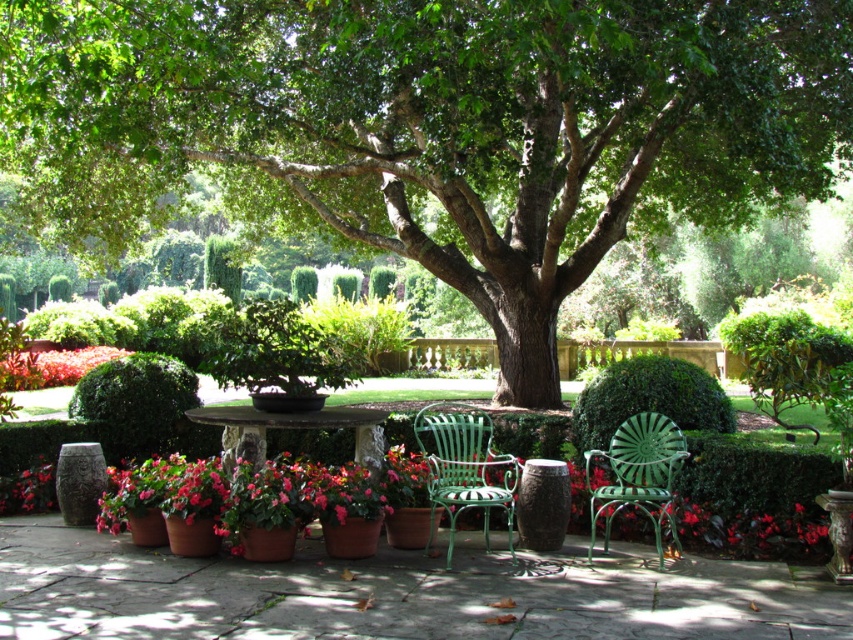
Question: Which of the following is the farthest from the observer?

Choices:
 (A) green textured bush at center
 (B) green textured hedge at center

Answer: (A)

Question: Which object appears farthest from the camera in this image?

Choices:
 (A) vivid red petals at lower left
 (B) green textured hedge at center
 (C) green leafy tree at center

Answer: (A)

Question: Does green wrought iron chair at center appear under vivid red petals at lower left?

Choices:
 (A) no
 (B) yes

Answer: (B)

Question: Which point is farther to the camera?

Choices:
 (A) (91, 392)
 (B) (637, 506)
 (C) (503, 465)
 (D) (103, 348)

Answer: (D)

Question: Is green metal chair at center smaller than stone table at center?

Choices:
 (A) yes
 (B) no

Answer: (B)

Question: Is green leafy tree at center to the right of stone table at center from the viewer's perspective?

Choices:
 (A) yes
 (B) no

Answer: (A)